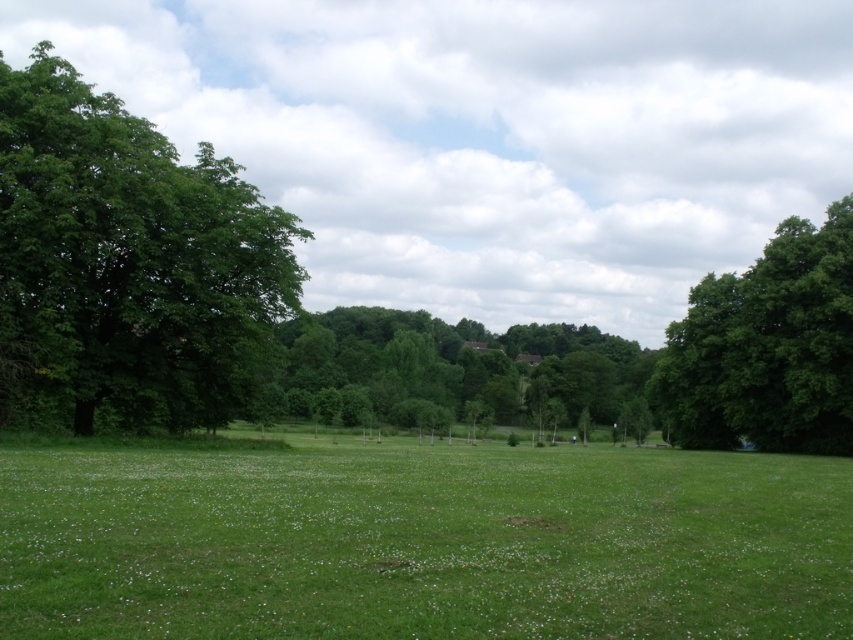
Question: Estimate the real-world distances between objects in this image. Which object is closer to the green leafy tree at left?

Choices:
 (A) green leafy tree at right
 (B) green leafy tree at center
 (C) green grassy field at center

Answer: (C)

Question: Estimate the real-world distances between objects in this image. Which object is farther from the green leafy tree at center?

Choices:
 (A) green leafy tree at left
 (B) green leafy tree at right
 (C) green grassy field at center

Answer: (C)

Question: Is green leafy tree at right positioned at the back of green leafy tree at center?

Choices:
 (A) yes
 (B) no

Answer: (A)

Question: Can you confirm if green grassy field at center is bigger than green leafy tree at left?

Choices:
 (A) yes
 (B) no

Answer: (B)

Question: Does green leafy tree at left appear on the left side of green leafy tree at right?

Choices:
 (A) yes
 (B) no

Answer: (A)

Question: Among these points, which one is farthest from the camera?

Choices:
 (A) (103, 257)
 (B) (809, 627)
 (C) (573, 353)

Answer: (C)